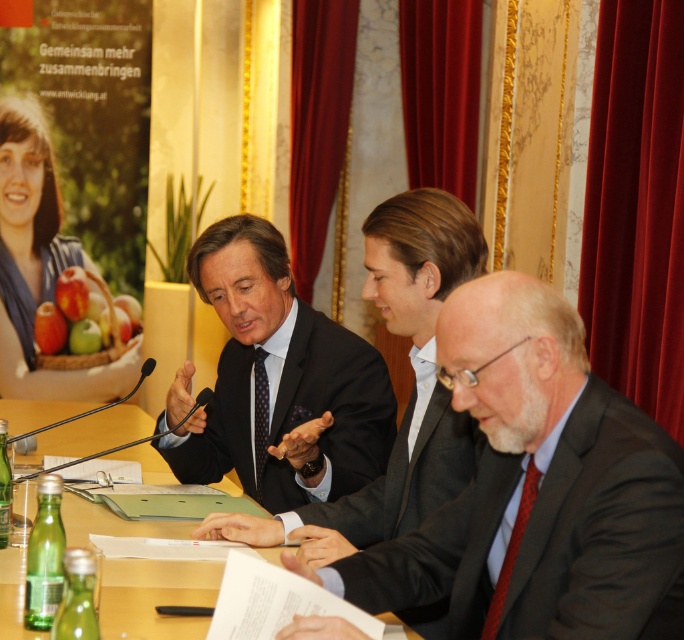
Who is more forward, (358, 401) or (475, 435)?

Point (475, 435)

Does dark blue textured suit at center have a lesser width compared to dark gray suit at center?

In fact, dark blue textured suit at center might be wider than dark gray suit at center.

Identify the location of dark blue textured suit at center. This screenshot has height=640, width=684. [328, 408].

Is dark blue textured suit at center wider than wooden table at center?

In fact, dark blue textured suit at center might be narrower than wooden table at center.

Between dark blue textured suit at center and wooden table at center, which one appears on the left side from the viewer's perspective?

wooden table at center

Is point (189, 476) positioned behind point (118, 413)?

No, it is in front of (118, 413).

Locate an element on the screen. dark blue textured suit at center is located at coordinates (328, 408).

Which of these two, black matte suit at lower right or dark gray suit at center, stands taller?

black matte suit at lower right is taller.

Does black matte suit at lower right have a lesser height compared to dark gray suit at center?

No.

Is point (475, 518) less distant than point (347, 499)?

Yes, point (475, 518) is closer to viewer.

Identify the location of black matte suit at lower right. (603, 531).